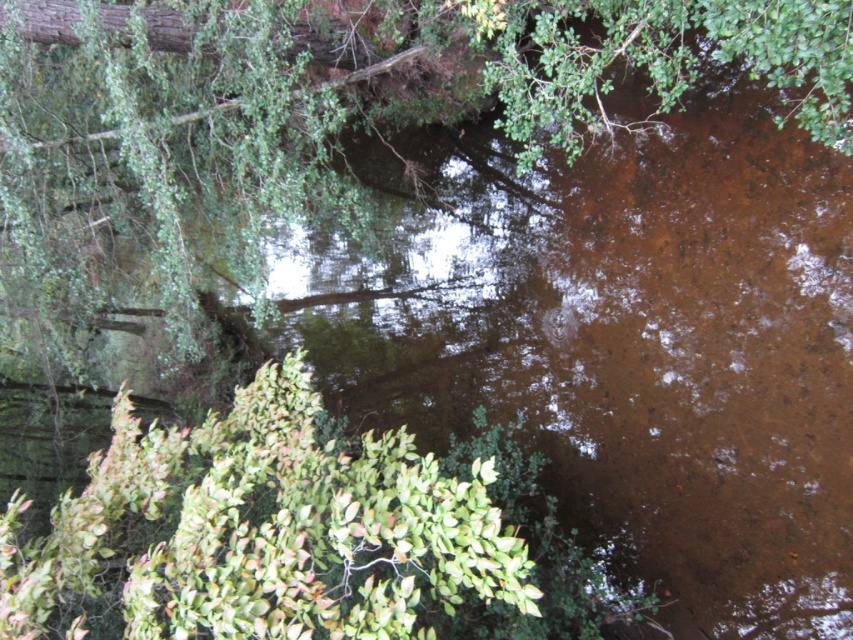
Question: Can you confirm if green leafy tree at upper left is thinner than green leafy bush at lower left?

Choices:
 (A) yes
 (B) no

Answer: (B)

Question: Which of the following is the farthest from the observer?

Choices:
 (A) (776, 51)
 (B) (461, 538)

Answer: (A)

Question: Which object is closer to the camera taking this photo?

Choices:
 (A) green leafy bush at lower left
 (B) green leafy tree at upper left

Answer: (A)

Question: Which point is farther from the camera taking this photo?

Choices:
 (A) (62, 536)
 (B) (805, 92)

Answer: (B)

Question: Is green leafy tree at upper left smaller than green leafy bush at lower left?

Choices:
 (A) yes
 (B) no

Answer: (A)

Question: Where is green leafy tree at upper left located in relation to green leafy bush at lower left in the image?

Choices:
 (A) left
 (B) right

Answer: (A)